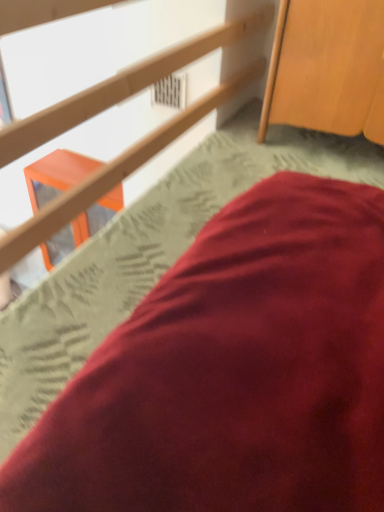
Question: Does wooden cabinet at upper right have a smaller size compared to matte wood rail at upper center?

Choices:
 (A) yes
 (B) no

Answer: (A)

Question: From the image's perspective, is wooden cabinet at upper right over matte wood rail at upper center?

Choices:
 (A) no
 (B) yes

Answer: (B)

Question: Does wooden cabinet at upper right have a greater height compared to matte wood rail at upper center?

Choices:
 (A) no
 (B) yes

Answer: (A)

Question: From the image's perspective, is wooden cabinet at upper right beneath matte wood rail at upper center?

Choices:
 (A) no
 (B) yes

Answer: (A)

Question: Considering the relative sizes of wooden cabinet at upper right and matte wood rail at upper center in the image provided, is wooden cabinet at upper right shorter than matte wood rail at upper center?

Choices:
 (A) yes
 (B) no

Answer: (A)

Question: From the image's perspective, is matte wood rail at upper center positioned above or below satin red pillow at lower right?

Choices:
 (A) below
 (B) above

Answer: (B)

Question: Is matte wood rail at upper center spatially inside satin red pillow at lower right, or outside of it?

Choices:
 (A) inside
 (B) outside

Answer: (B)

Question: Based on their sizes in the image, would you say matte wood rail at upper center is bigger or smaller than satin red pillow at lower right?

Choices:
 (A) small
 (B) big

Answer: (B)

Question: Is matte wood rail at upper center in front of or behind satin red pillow at lower right in the image?

Choices:
 (A) front
 (B) behind

Answer: (A)

Question: Is wooden cabinet at upper right in front of or behind matte wood rail at upper center in the image?

Choices:
 (A) behind
 (B) front

Answer: (A)

Question: Which is correct: wooden cabinet at upper right is inside matte wood rail at upper center, or outside of it?

Choices:
 (A) outside
 (B) inside

Answer: (A)

Question: Considering the positions of wooden cabinet at upper right and matte wood rail at upper center in the image, is wooden cabinet at upper right wider or thinner than matte wood rail at upper center?

Choices:
 (A) wide
 (B) thin

Answer: (B)

Question: From a real-world perspective, is wooden cabinet at upper right positioned above or below matte wood rail at upper center?

Choices:
 (A) above
 (B) below

Answer: (B)

Question: Is satin red pillow at lower right inside the boundaries of wooden cabinet at upper right, or outside?

Choices:
 (A) inside
 (B) outside

Answer: (B)

Question: In terms of height, does satin red pillow at lower right look taller or shorter compared to wooden cabinet at upper right?

Choices:
 (A) short
 (B) tall

Answer: (A)